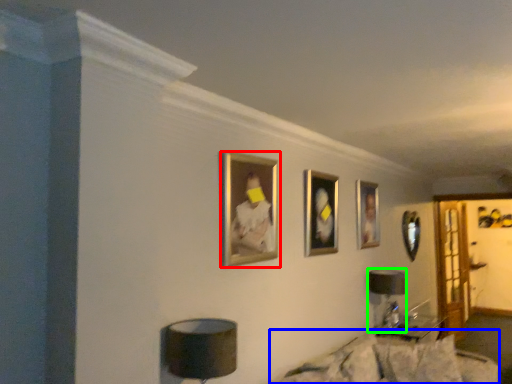
Question: Based on their relative distances, which object is farther from picture frame (highlighted by a red box)? Choose from couch (highlighted by a blue box) and table lamp (highlighted by a green box).

Choices:
 (A) couch
 (B) table lamp

Answer: (B)